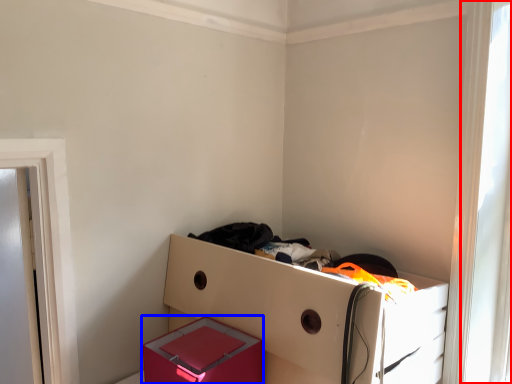
Question: Which object appears closest to the camera in this image, window (highlighted by a red box) or box (highlighted by a blue box)?

Choices:
 (A) window
 (B) box

Answer: (B)